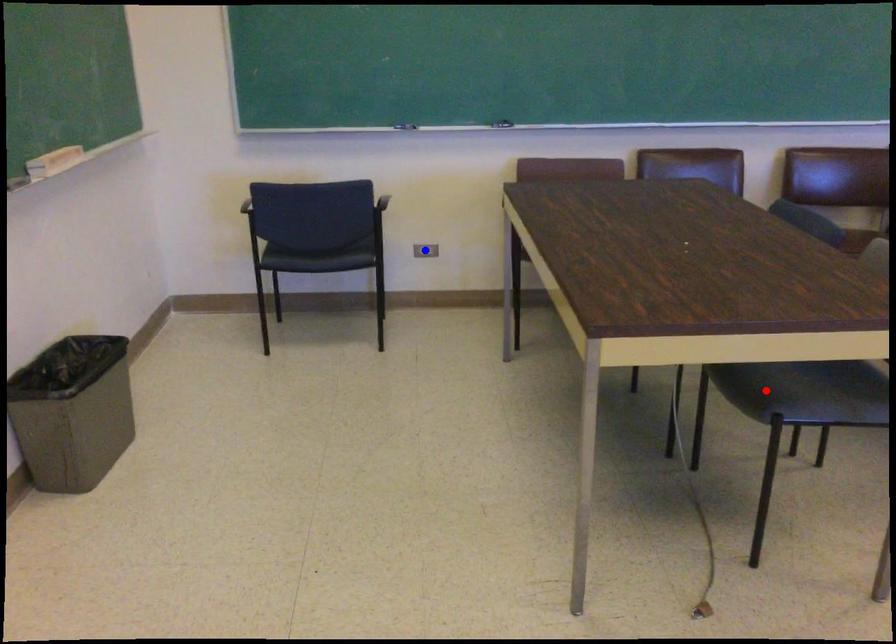
Question: In the image, two points are highlighted. Which point is nearer to the camera? Reply with the corresponding letter.

Choices:
 (A) blue point
 (B) red point

Answer: (B)